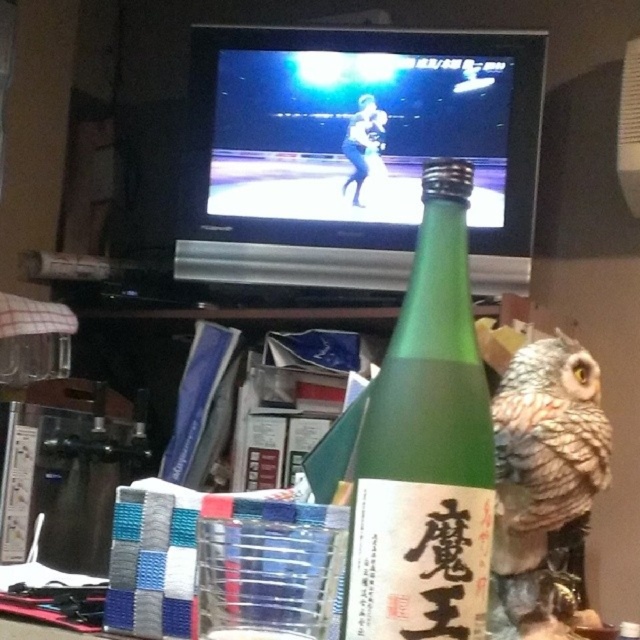
Question: Which point appears farthest from the camera in this image?

Choices:
 (A) (472, 548)
 (B) (600, 435)

Answer: (B)

Question: Considering the relative positions of green glass bottle at center and brown speckled owl at right in the image provided, where is green glass bottle at center located with respect to brown speckled owl at right?

Choices:
 (A) below
 (B) above

Answer: (B)

Question: Can you confirm if green glass bottle at center is smaller than brown speckled owl at right?

Choices:
 (A) no
 (B) yes

Answer: (A)

Question: Which point is farther to the camera?

Choices:
 (A) (572, 394)
 (B) (362, 474)

Answer: (A)

Question: Is green glass bottle at center to the right of brown speckled owl at right from the viewer's perspective?

Choices:
 (A) yes
 (B) no

Answer: (B)